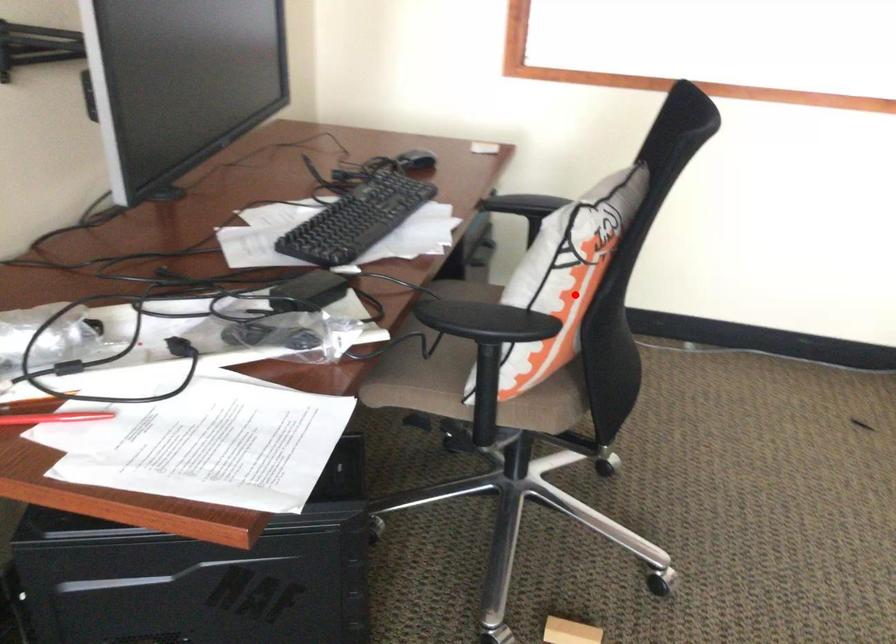
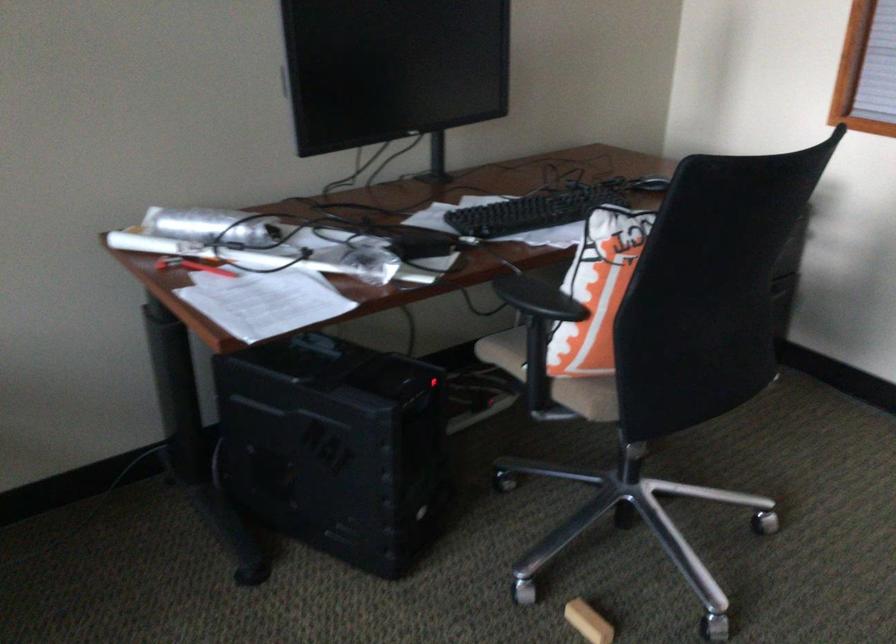
Question: I am providing you with two images of the same scene from different viewpoints. Image1 has a red point marked. In image2, the corresponding 3D location appears at what relative position? Reply with the corresponding letter.

Choices:
 (A) Closer
 (B) Farther

Answer: (B)